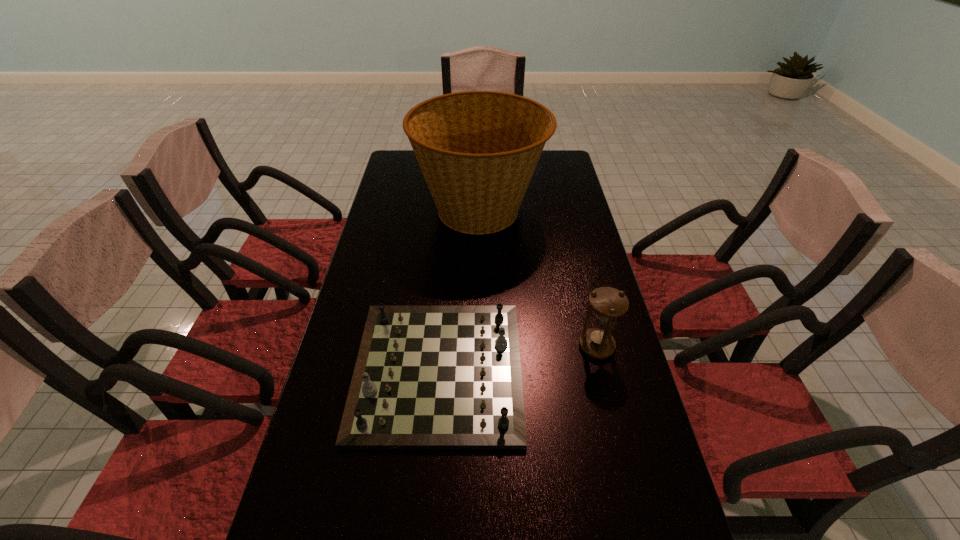
Image resolution: width=960 pixels, height=540 pixels. Find the location of `object that stands as the closest to the basket`. object that stands as the closest to the basket is located at coordinates (426, 377).

You are a GUI agent. You are given a task and a screenshot of the screen. Output one action in this format:
    pyautogui.click(x=<x>, y=<y>)
    Task: Click on the object that stands as the second closest to the shortest object
    The image size is (960, 540).
    Given the screenshot: What is the action you would take?
    pyautogui.click(x=477, y=150)

The image size is (960, 540). I want to click on vacant position in the image that satisfies the following two spatial constraints: 1. on the front side of the tallest object; 2. on the left side of the hourglass, so click(480, 346).

Find the location of `vacant space that satisfies the following two spatial constraints: 1. on the front side of the hourglass; 2. on the board of the shortest object`. vacant space that satisfies the following two spatial constraints: 1. on the front side of the hourglass; 2. on the board of the shortest object is located at coordinates (602, 370).

This screenshot has width=960, height=540. I want to click on vacant point that satisfies the following two spatial constraints: 1. on the front side of the rightmost object; 2. on the board of the chessboard, so click(x=602, y=370).